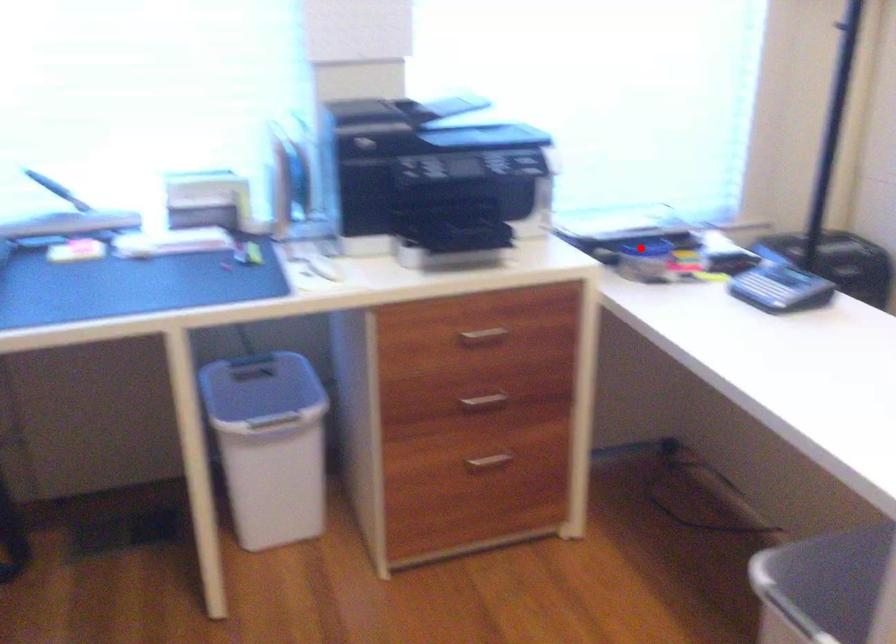
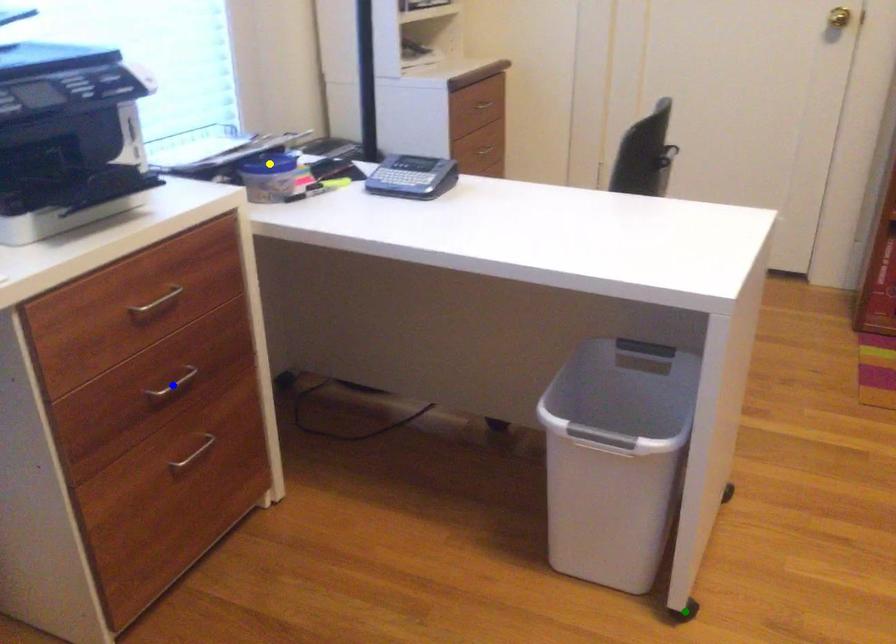
Question: I am providing you with two images of the same scene from different viewpoints. A red point is marked on the first image. You are given multiple points on the second image. In image 2, which mark is for the same physical point as the one in image 1?

Choices:
 (A) green point
 (B) yellow point
 (C) blue point

Answer: (B)